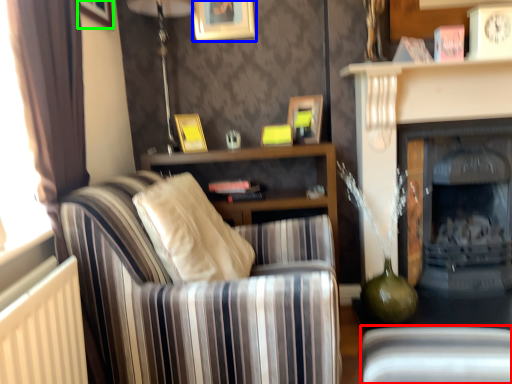
Question: Considering the real-world distances, which object is closest to swivel chair (highlighted by a red box)? picture frame (highlighted by a blue box) or picture frame (highlighted by a green box).

Choices:
 (A) picture frame
 (B) picture frame

Answer: (A)